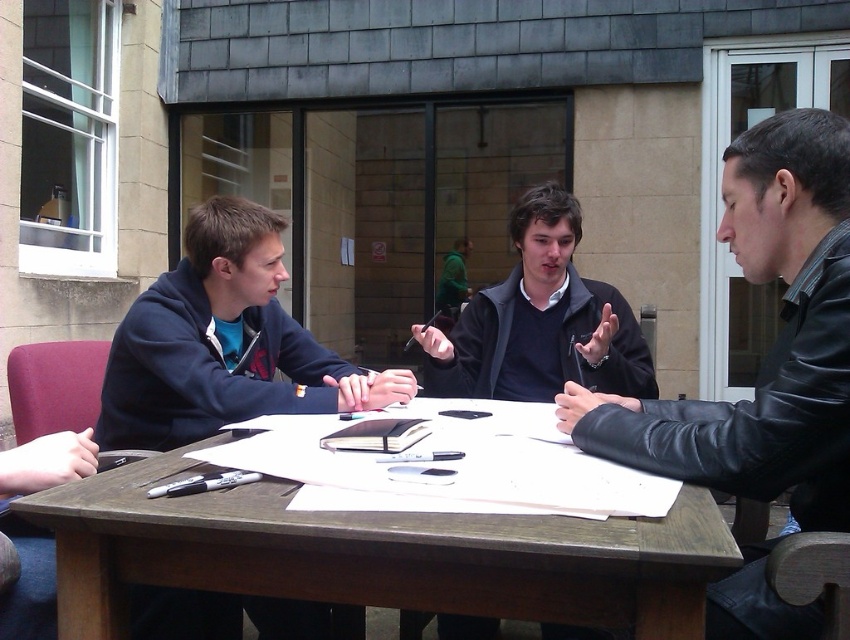
Question: Does brown wooden table at center appear on the left side of black leather jacket at right?

Choices:
 (A) yes
 (B) no

Answer: (A)

Question: Which of the following is the farthest from the observer?

Choices:
 (A) (706, 513)
 (B) (842, 218)

Answer: (B)

Question: Considering the relative positions of brown wooden table at center and black leather jacket at right in the image provided, where is brown wooden table at center located with respect to black leather jacket at right?

Choices:
 (A) below
 (B) above

Answer: (A)

Question: Can you confirm if brown wooden table at center is smaller than black leather jacket at right?

Choices:
 (A) no
 (B) yes

Answer: (B)

Question: Which point is closer to the camera?

Choices:
 (A) brown wooden table at center
 (B) black leather jacket at right

Answer: (A)